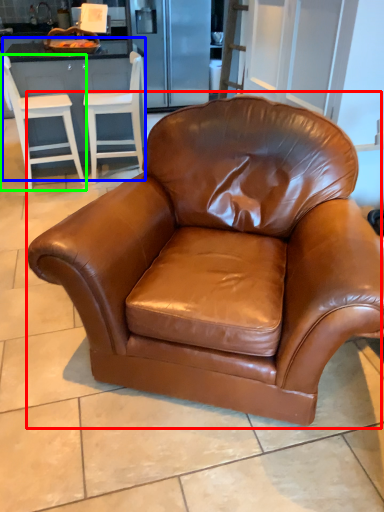
Question: Based on their relative distances, which object is farther from chair (highlighted by a red box)? Choose from dresser (highlighted by a blue box) and chair (highlighted by a green box).

Choices:
 (A) dresser
 (B) chair

Answer: (B)